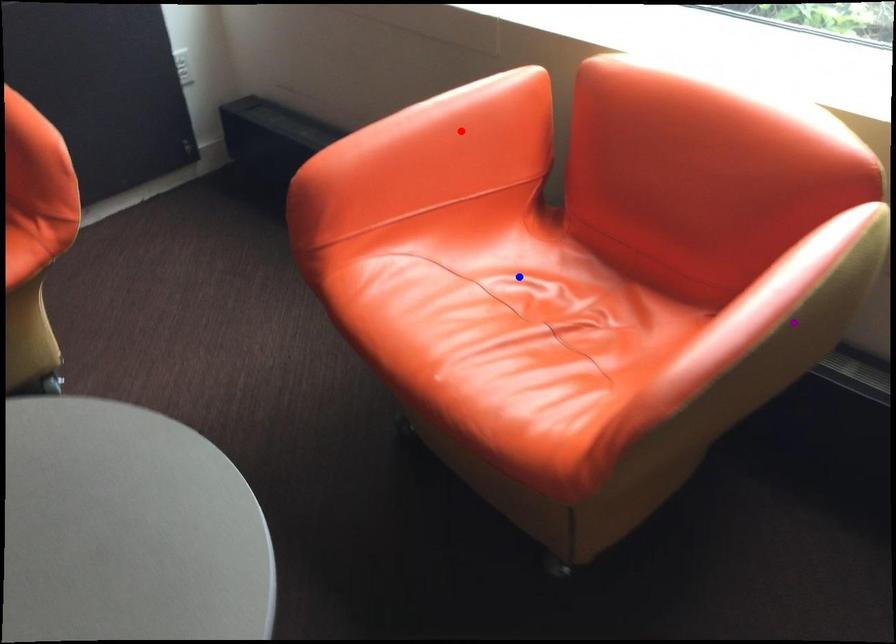
Order these from nearest to farthest:
- red point
- purple point
- blue point

purple point < blue point < red point